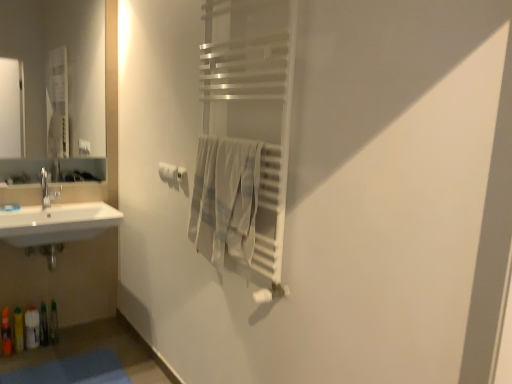
This screenshot has height=384, width=512. Find the location of `vacant space behind translucent plastic bottles at lower left, positioned as the 1th toiletry in right-to-left order`. vacant space behind translucent plastic bottles at lower left, positioned as the 1th toiletry in right-to-left order is located at coordinates (72, 331).